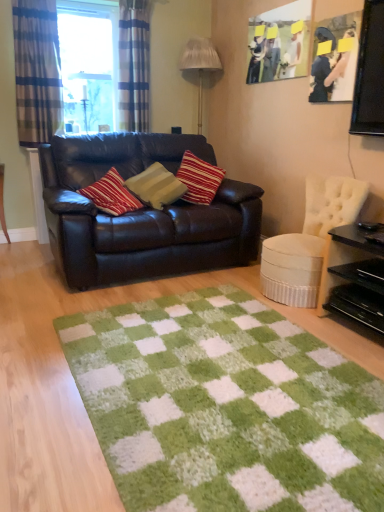
Question: Considering the relative positions of black glossy table at right and matte wooden picture frame at upper right, the 1th picture frame viewed from the back, in the image provided, is black glossy table at right to the left or to the right of matte wooden picture frame at upper right, the 1th picture frame viewed from the back,?

Choices:
 (A) left
 (B) right

Answer: (B)

Question: From a real-world perspective, is black glossy table at right above or below matte wooden picture frame at upper right, which appears as the 2th picture frame when viewed from the right?

Choices:
 (A) below
 (B) above

Answer: (A)

Question: Based on their relative distances, which object is nearer to the matte wooden picture frame at upper right, which ranks as the 1th picture frame in left-to-right order?

Choices:
 (A) green shaggy rug at center
 (B) white tufted chair at right
 (C) black plastic drawer at lower right
 (D) matte black picture frame at upper right, placed as the 1th picture frame when sorted from right to left
 (E) plaid fabric curtain at left, acting as the second curtain starting from the right

Answer: (D)

Question: Based on their relative distances, which object is farther from the matte black couch at center?

Choices:
 (A) white tufted chair at right
 (B) striped fabric pillow at center
 (C) matte black picture frame at upper right, the second picture frame in the back-to-front sequence
 (D) black glossy table at right
 (E) green shaggy rug at center

Answer: (C)